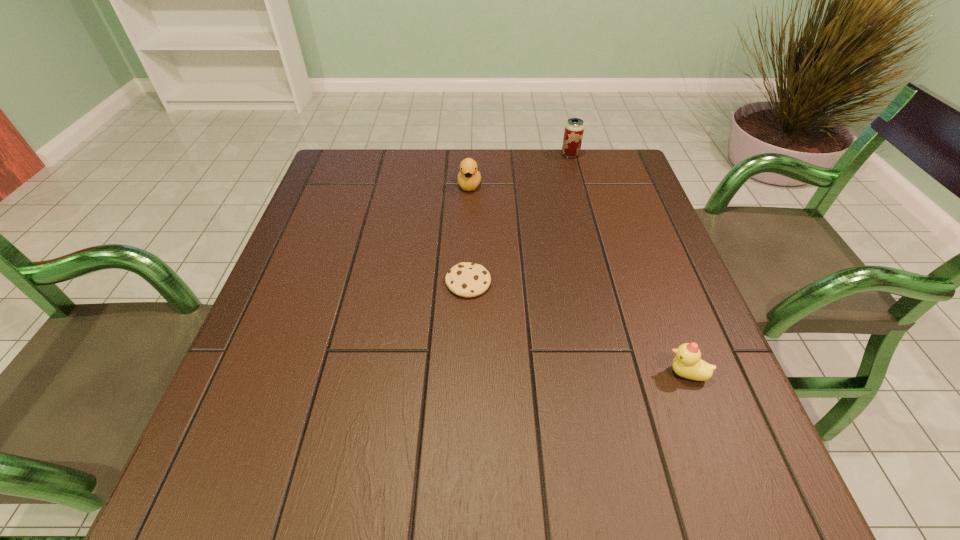
Identify the location of beer can. The height and width of the screenshot is (540, 960). (574, 128).

At what (x,y) coordinates should I click in order to perform the action: click on the tallest object. Please return your answer as a coordinate pair (x, y). The image size is (960, 540). Looking at the image, I should click on (574, 128).

This screenshot has height=540, width=960. What are the coordinates of `the left duckling` in the screenshot? It's located at [468, 178].

The image size is (960, 540). What are the coordinates of `the farther duckling` in the screenshot? It's located at (468, 178).

Where is `the nearest object`? The height and width of the screenshot is (540, 960). the nearest object is located at coordinates (688, 363).

The height and width of the screenshot is (540, 960). I want to click on the right duckling, so click(x=688, y=363).

I want to click on cookie, so click(x=465, y=279).

Locate an element on the screen. the third farthest object is located at coordinates (465, 279).

Image resolution: width=960 pixels, height=540 pixels. What are the coordinates of `vacant space situated 0.300m on the left of the tallest object` in the screenshot? It's located at (464, 154).

Find the location of a particular element. Image resolution: width=960 pixels, height=540 pixels. vacant space situated 0.350m facing forward on the third nearest object is located at coordinates (467, 291).